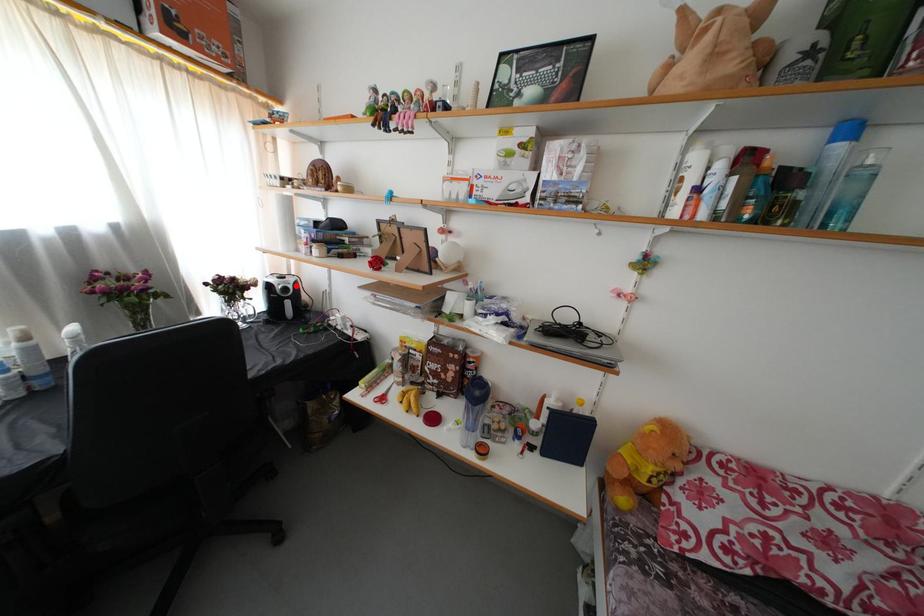
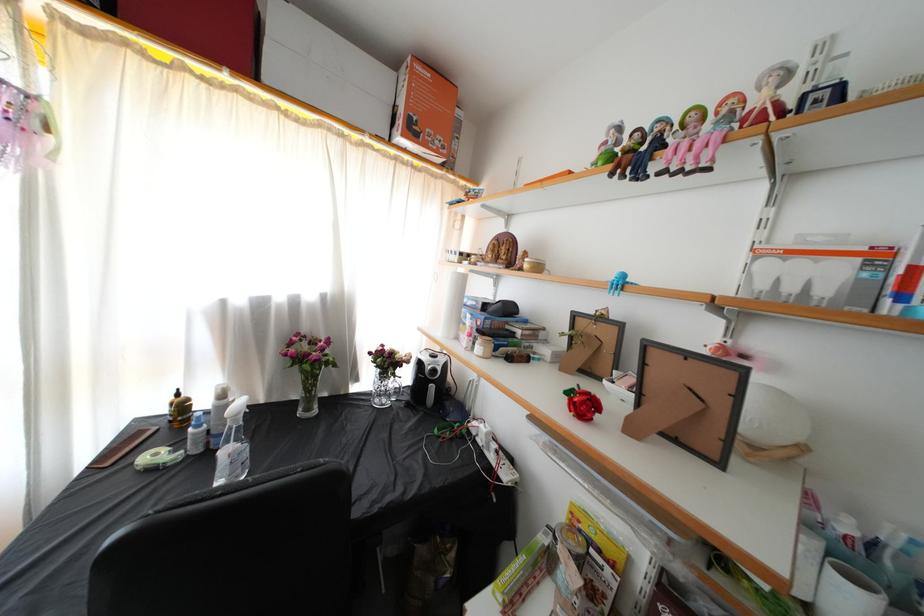
In the second image, find the point that corresponds to the highlighted location in the first image.

(446, 365)